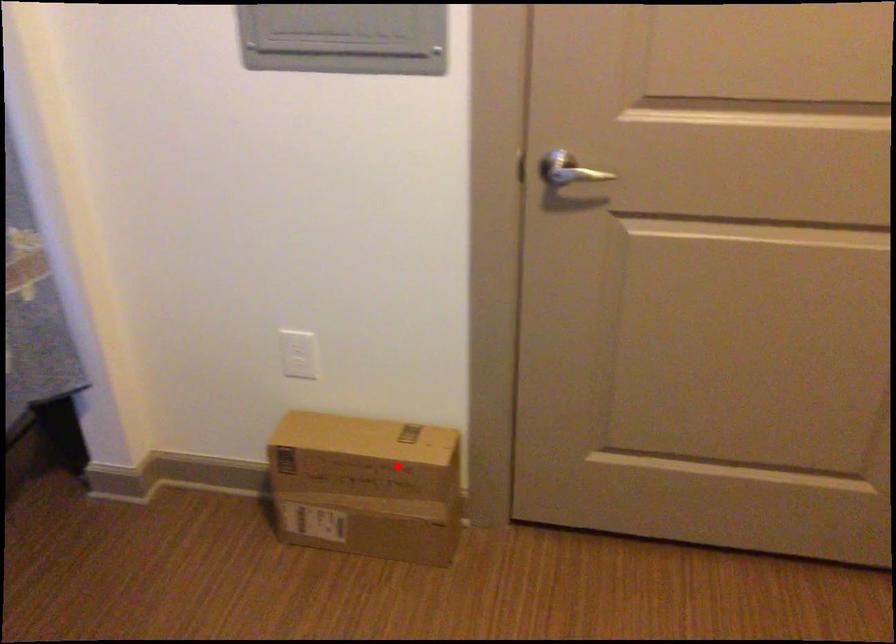
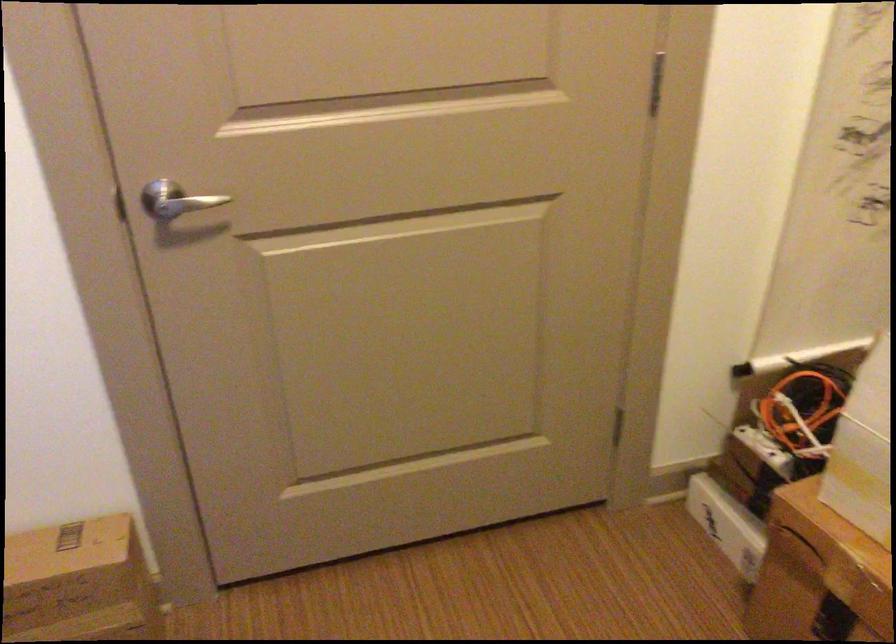
Question: I am providing you with two images of the same scene from different viewpoints. Image1 has a red point marked. In image2, the corresponding 3D location appears at what relative position? Reply with the corresponding letter.

Choices:
 (A) Closer
 (B) Farther

Answer: (A)